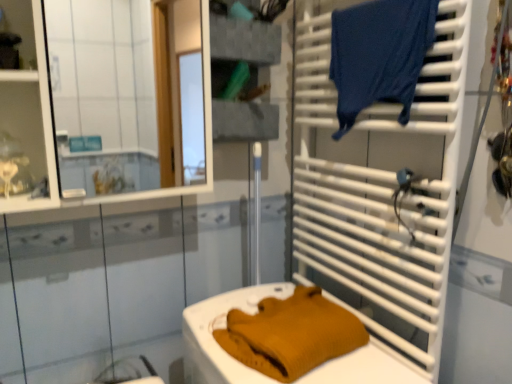
Question: From the image's perspective, is white plastic towel rack at right positioned above or below matte white shelf at upper left, which is the 1th shelf in front-to-back order?

Choices:
 (A) above
 (B) below

Answer: (B)

Question: Based on their sizes in the image, would you say white plastic towel rack at right is bigger or smaller than matte white shelf at upper left, which is the 1th shelf in front-to-back order?

Choices:
 (A) big
 (B) small

Answer: (A)

Question: Which is farther from the white glossy mirror at upper left?

Choices:
 (A) mustard knit sweater at lower center
 (B) white plastic towel rack at right
 (C) dark blue fabric at upper right
 (D) matte white shelf at upper left, which is the 1th shelf in front-to-back order
 (E) textured gray fabric at upper center, positioned as the second shelf in front-to-back order

Answer: (A)

Question: Which is farther from the white glossy mirror at upper left?

Choices:
 (A) textured gray fabric at upper center, positioned as the second shelf in front-to-back order
 (B) matte white shelf at upper left, acting as the second shelf starting from the back
 (C) mustard knit sweater at lower center
 (D) white plastic towel rack at right
 (E) dark blue fabric at upper right

Answer: (C)